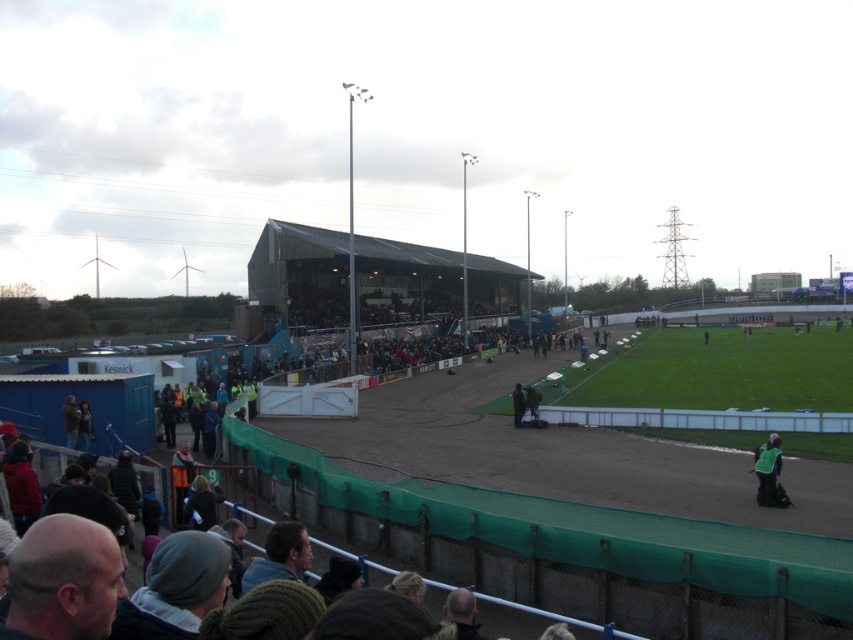
Question: Which object is farther from the camera taking this photo?

Choices:
 (A) dark green fabric at center
 (B) green reflective vest at lower right

Answer: (A)

Question: Which point is farther from the camera taking this photo?

Choices:
 (A) (757, 477)
 (B) (514, 388)

Answer: (B)

Question: Does green reflective vest at lower right have a greater width compared to dark green fabric at center?

Choices:
 (A) yes
 (B) no

Answer: (A)

Question: Is green reflective vest at lower right below dark green fabric at center?

Choices:
 (A) no
 (B) yes

Answer: (B)

Question: Considering the relative positions of green reflective vest at lower right and dark green fabric at center in the image provided, where is green reflective vest at lower right located with respect to dark green fabric at center?

Choices:
 (A) right
 (B) left

Answer: (A)